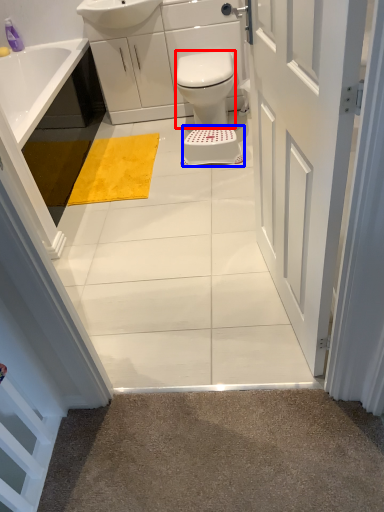
Question: Which point is closer to the camera, bidet (highlighted by a red box) or stool (highlighted by a blue box)?

Choices:
 (A) bidet
 (B) stool

Answer: (A)